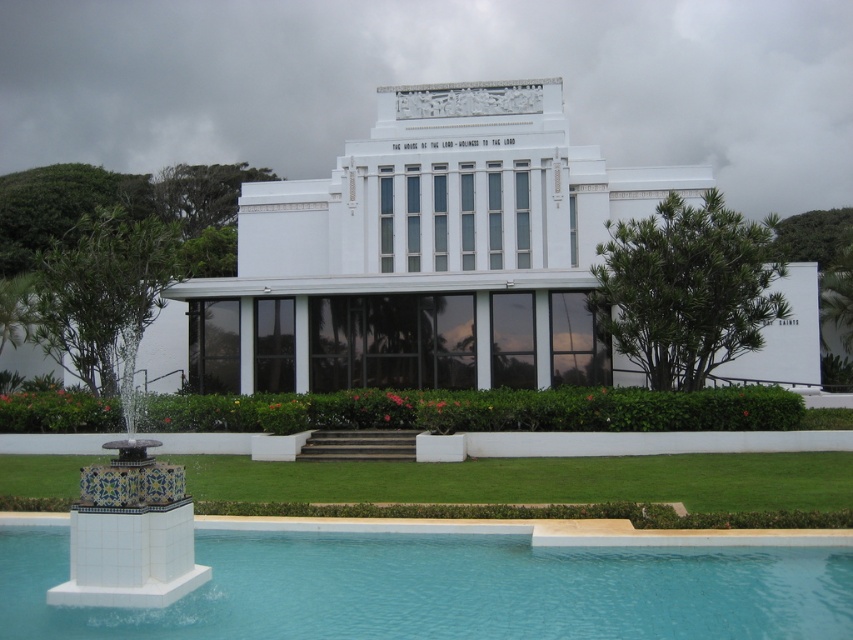
You are standing in front of the building and notice the blue glossy water at lower center and the green leafy tree at upper left. From your perspective, which object is positioned to the right of the other?

The blue glossy water at lower center is to the right of the green leafy tree at upper left.

You are standing in front of the building and want to take a photo of the blue glossy water at lower center and the green leafy tree at upper left. Which object should you focus on first to ensure both are in the frame?

You should focus on the green leafy tree at upper left first because the blue glossy water at lower center is in front of it, so adjusting the camera angle to include both would require ensuring the tree is within the frame while accounting for the water being closer.

You are standing in front of the modern white building with the inscription. There are two points marked on the ground in front of you. The first point is at coordinates point (x=119, y=330) and the second is at point (x=41, y=182). If you want to place a small flower pot between them, which point should you start walking towards to ensure the pot is closer to the building?

Since point (x=119, y=330) is closer to the camera than point (x=41, y=182), you should start walking towards point (x=41, y=182) to place the flower pot closer to the building.